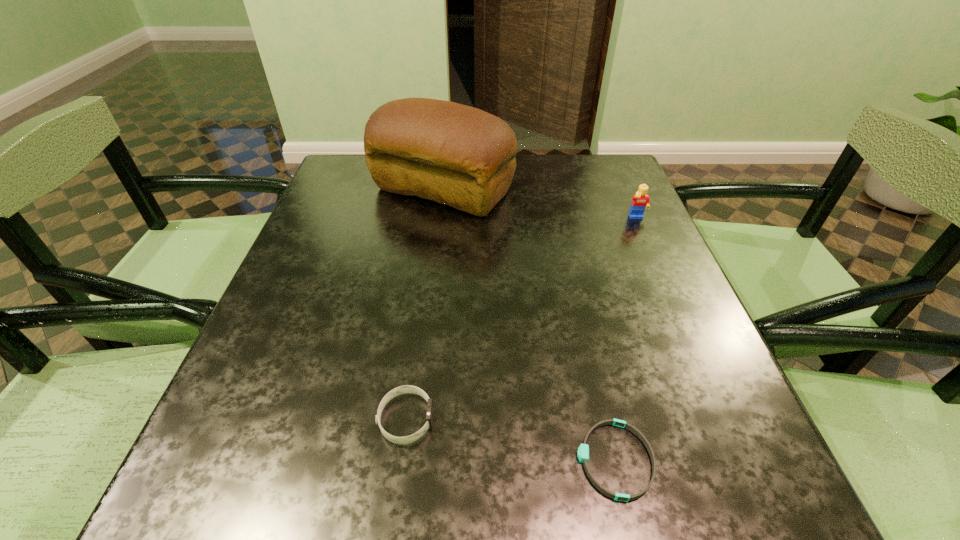
Image resolution: width=960 pixels, height=540 pixels. I want to click on free region at the near edge of the desktop, so tap(614, 462).

You are a GUI agent. You are given a task and a screenshot of the screen. Output one action in this format:
    pyautogui.click(x=<x>, y=<y>)
    Task: Click on the free space at the left edge of the desktop
    
    Given the screenshot: What is the action you would take?
    pyautogui.click(x=338, y=294)

Locate an element on the screen. vacant space at the right edge of the desktop is located at coordinates (658, 309).

Where is `free space between the bread and the left wristband`? Image resolution: width=960 pixels, height=540 pixels. free space between the bread and the left wristband is located at coordinates (424, 305).

Identify the location of empty space that is in between the bread and the second shortest object. The height and width of the screenshot is (540, 960). (424, 305).

Identify the location of empty space between the tallest object and the third shortest object. This screenshot has width=960, height=540. (540, 204).

The height and width of the screenshot is (540, 960). I want to click on free space between the third shortest object and the third tallest object, so 521,319.

The height and width of the screenshot is (540, 960). What are the coordinates of `vacant area that lies between the third object from left to right and the bread` in the screenshot? It's located at (529, 325).

Where is `free space that is in between the rightmost object and the tallest object`? free space that is in between the rightmost object and the tallest object is located at coordinates (540, 204).

The height and width of the screenshot is (540, 960). Identify the location of vacant space that's between the third shortest object and the taller wristband. (521, 319).